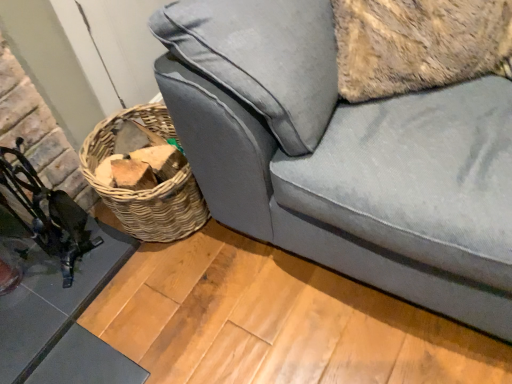
Question: From the image's perspective, is glassy black table at lower left located beneath velvet gray couch at lower right?

Choices:
 (A) no
 (B) yes

Answer: (B)

Question: Does glassy black table at lower left come behind velvet gray couch at lower right?

Choices:
 (A) no
 (B) yes

Answer: (B)

Question: From a real-world perspective, is glassy black table at lower left physically below velvet gray couch at lower right?

Choices:
 (A) no
 (B) yes

Answer: (B)

Question: Is glassy black table at lower left positioned with its back to velvet gray couch at lower right?

Choices:
 (A) no
 (B) yes

Answer: (A)

Question: From the image's perspective, is glassy black table at lower left on top of velvet gray couch at lower right?

Choices:
 (A) no
 (B) yes

Answer: (A)

Question: Can you confirm if glassy black table at lower left is wider than velvet gray couch at lower right?

Choices:
 (A) no
 (B) yes

Answer: (A)

Question: Can you confirm if metallic black swivel chair at left is positioned to the left of woven brown basket at lower left?

Choices:
 (A) yes
 (B) no

Answer: (A)

Question: Is metallic black swivel chair at left looking in the opposite direction of woven brown basket at lower left?

Choices:
 (A) no
 (B) yes

Answer: (A)

Question: Is metallic black swivel chair at left shorter than woven brown basket at lower left?

Choices:
 (A) no
 (B) yes

Answer: (A)

Question: From a real-world perspective, does metallic black swivel chair at left stand above woven brown basket at lower left?

Choices:
 (A) yes
 (B) no

Answer: (A)

Question: Is metallic black swivel chair at left positioned in front of woven brown basket at lower left?

Choices:
 (A) yes
 (B) no

Answer: (A)

Question: From the image's perspective, is metallic black swivel chair at left above woven brown basket at lower left?

Choices:
 (A) no
 (B) yes

Answer: (A)

Question: From a real-world perspective, does metallic black swivel chair at left sit lower than glassy black table at lower left?

Choices:
 (A) no
 (B) yes

Answer: (A)